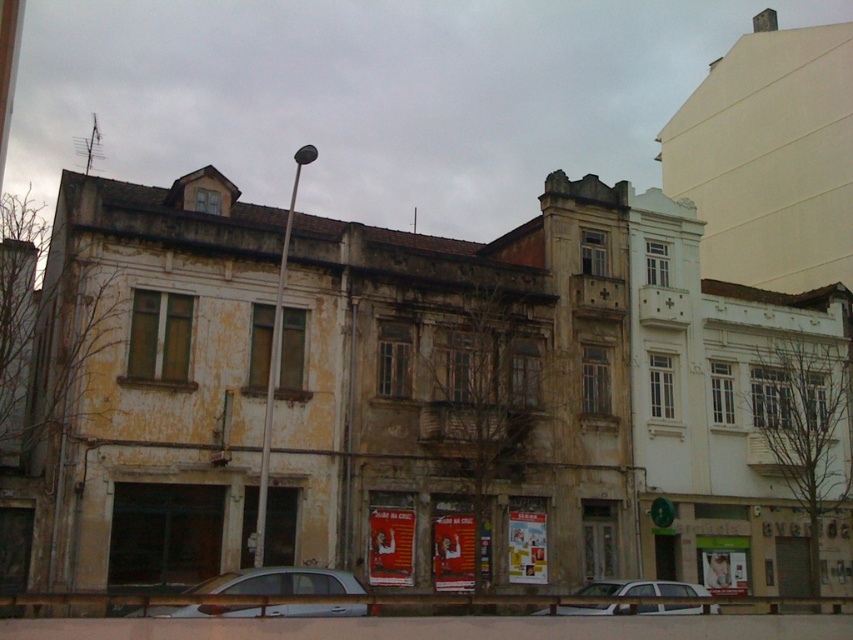
You are a delivery driver trying to park your white matte car at center in a narrow alley between the two buildings. The alley is only wide enough for one car. You see the silver metallic sedan at center already parked there. Can you fit your car into the space if you move the sedan?

The silver metallic sedan at center is smaller than the white matte car at center. Since the alley is only wide enough for one car, moving the sedan would allow space for the larger white matte car at center to park there instead.

You are a pedestrian standing on the sidewalk and want to cross the street to reach the central building. There are two cars in front of you, a silver metallic sedan at center and a white matte car at center. Which car is blocking your path more directly?

The silver metallic sedan at center is above the white matte car at center, so it is positioned higher and closer to the central building. This means the silver metallic sedan at center is blocking your path more directly.